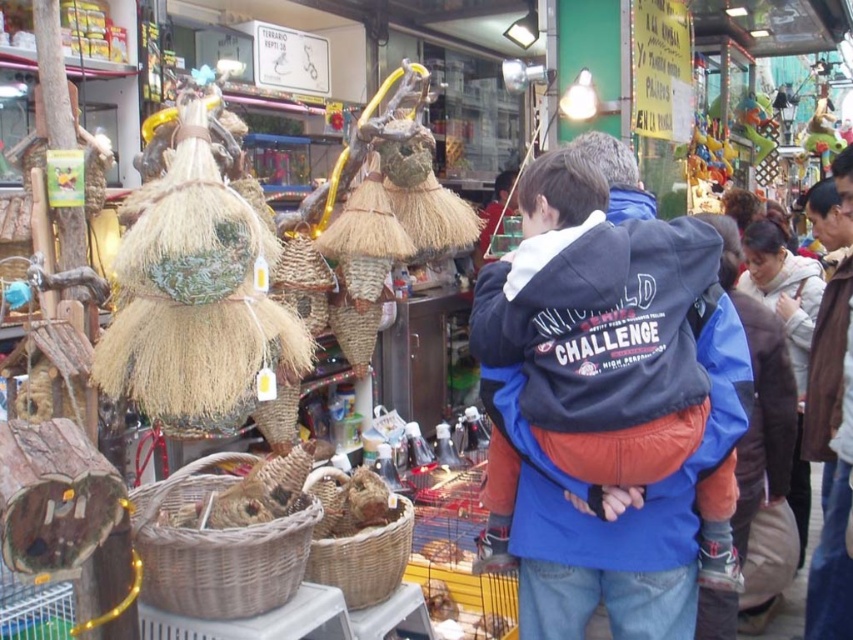
You are an observer at the market. You see the blue fleece jacket at center and the woven brown basket at center. Which object is closer to you?

The blue fleece jacket at center is closer to you because it is in front of the woven brown basket at center.

You are a customer at the market and want to choose between the woven brown basket at center and the woven brown basket at lower center. Which basket has a larger width?

The woven brown basket at center might be wider than woven brown basket at lower center.

You are a customer at the market and want to buy the woven brown basket at lower center. You notice the blue fleece jacket at center nearby. Which direction should you move to reach the basket from the jacket?

The blue fleece jacket at center is to the right of the woven brown basket at lower center, so you should move to the left to reach the basket from the jacket.